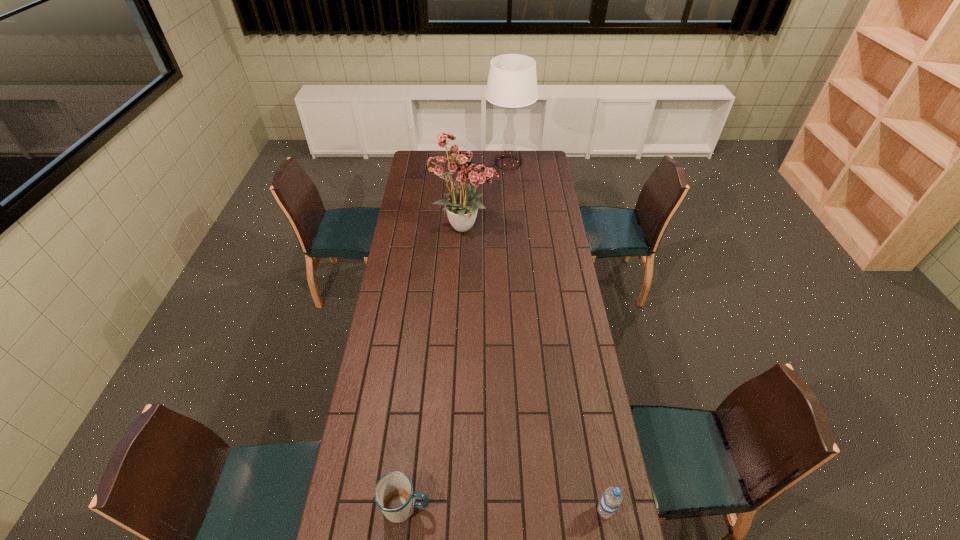
The height and width of the screenshot is (540, 960). I want to click on vacant space located on the handle side of the shortest object, so click(x=515, y=506).

I want to click on object present at the far edge, so click(512, 82).

The height and width of the screenshot is (540, 960). I want to click on flower arrangement positioned at the left edge, so click(460, 168).

Identify the location of mug located at the left edge. This screenshot has height=540, width=960. (394, 494).

The height and width of the screenshot is (540, 960). In order to click on table lamp situated at the right edge in this screenshot , I will do `click(512, 82)`.

At what (x,y) coordinates should I click in order to perform the action: click on water bottle present at the right edge. Please return your answer as a coordinate pair (x, y). The width and height of the screenshot is (960, 540). Looking at the image, I should click on (611, 499).

I want to click on object that is at the far right corner, so (512, 82).

Find the location of a particular element. vacant space at the left edge of the desktop is located at coordinates (397, 289).

The width and height of the screenshot is (960, 540). Identify the location of vacant space at the right edge. (536, 190).

This screenshot has height=540, width=960. What are the coordinates of `vacant space that is in between the farthest object and the third nearest object` in the screenshot? It's located at (487, 195).